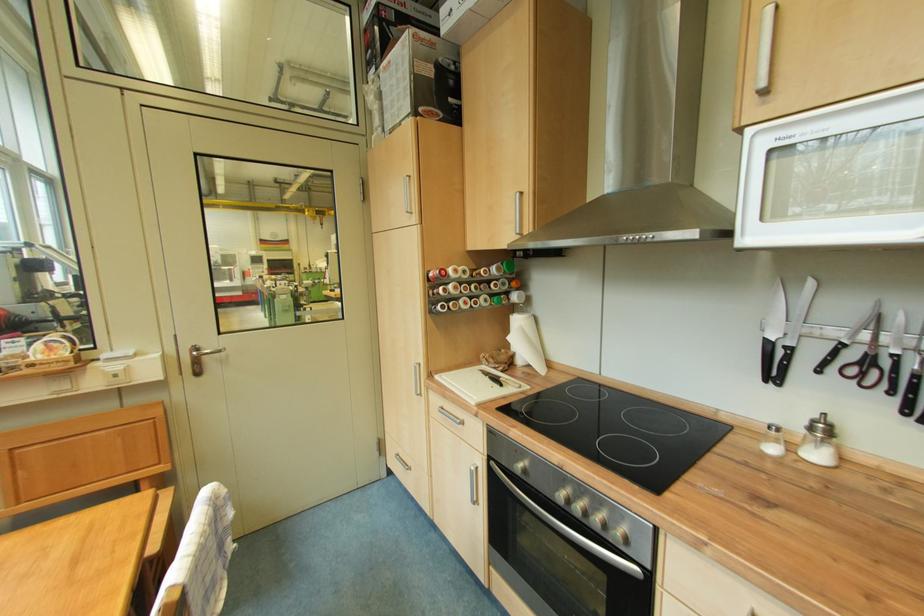
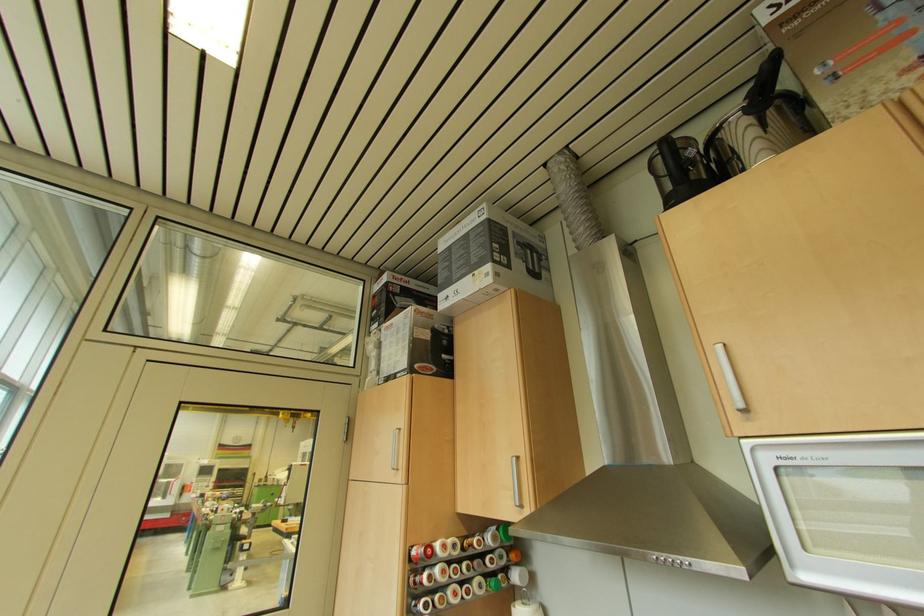
Where in the second image is the point corresponding to pixel 478 251 from the first image?

(468, 513)